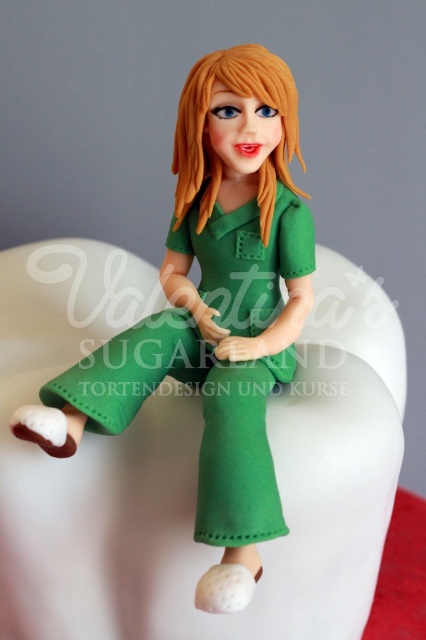
Is point (224, 540) closer to camera compared to point (284, 113)?

Yes, point (224, 540) is in front of point (284, 113).

Consider the image. Is matte green dress at center shorter than blonde glossy hair at center?

No.

Which is behind, point (222, 566) or point (178, 189)?

The point (178, 189) is behind.

This screenshot has height=640, width=426. I want to click on matte green dress at center, so click(x=213, y=310).